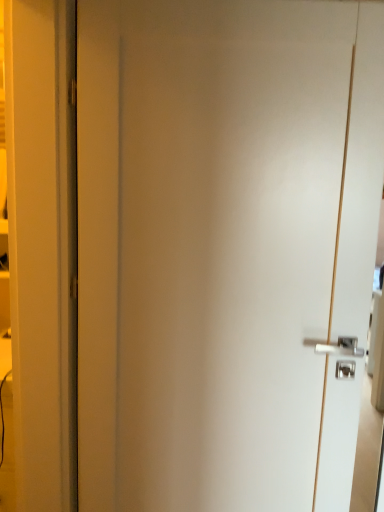
Question: Should I look upward or downward to see white glossy door at center?

Choices:
 (A) down
 (B) up

Answer: (A)